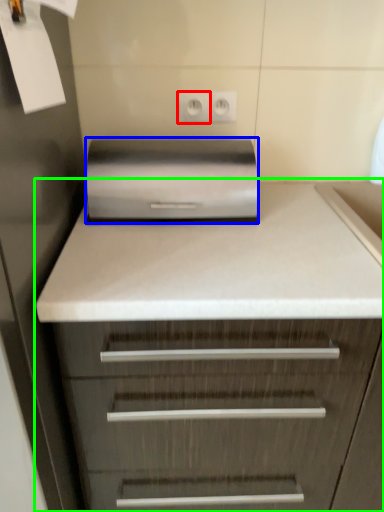
Question: Which is nearer to the electric outlet (highlighted by a red box)? home appliance (highlighted by a blue box) or chest of drawers (highlighted by a green box).

Choices:
 (A) home appliance
 (B) chest of drawers

Answer: (A)